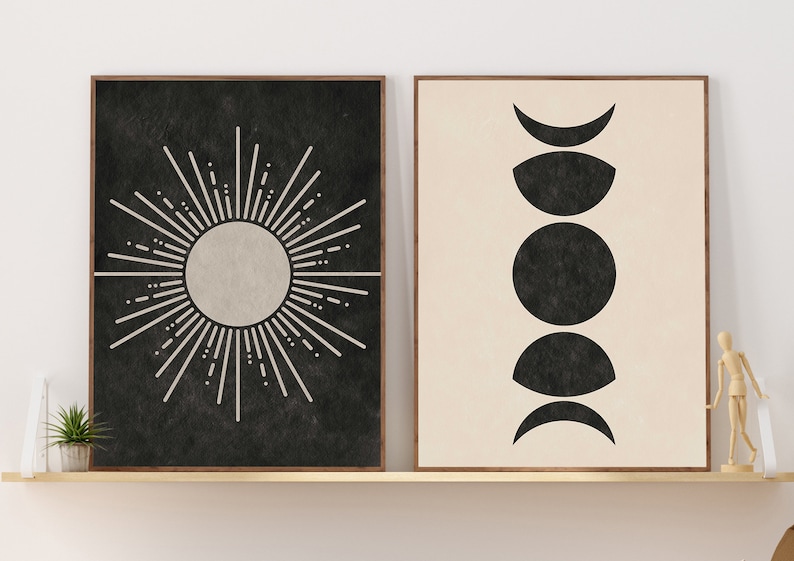
You are a GUI agent. You are given a task and a screenshot of the screen. Output one action in this format:
    pyautogui.click(x=<x>, y=<y>)
    Task: Click on the artwork
    The width and height of the screenshot is (794, 561).
    Given the screenshot: What is the action you would take?
    pyautogui.click(x=455, y=201), pyautogui.click(x=306, y=132)